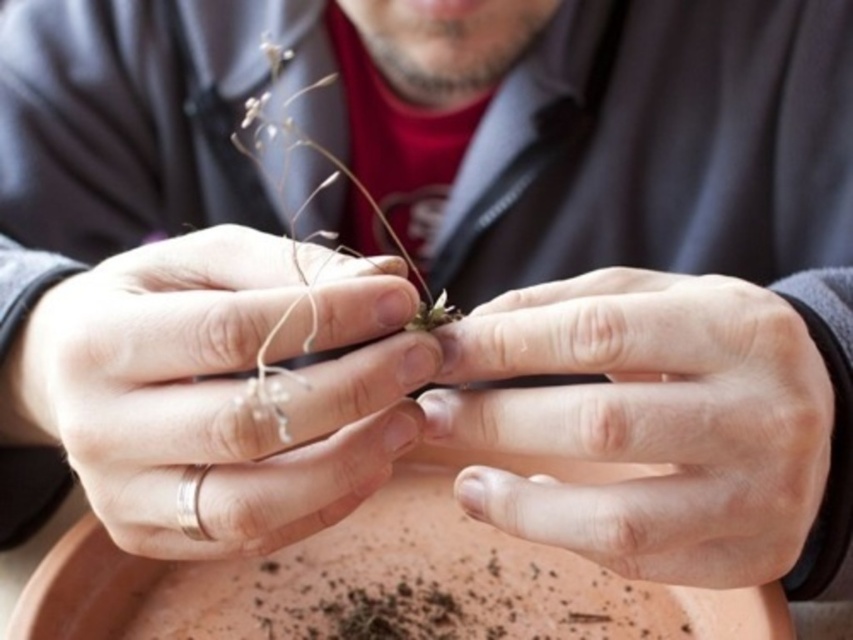
Locate an element on the screen. The height and width of the screenshot is (640, 853). silver metallic ring at center is located at coordinates (202, 397).

Which of these two, silver metallic ring at center or smooth skin hand at center, stands shorter?

smooth skin hand at center

Which is behind, point (265, 296) or point (775, 468)?

Point (775, 468)

The height and width of the screenshot is (640, 853). Find the location of `silver metallic ring at center`. silver metallic ring at center is located at coordinates (202, 397).